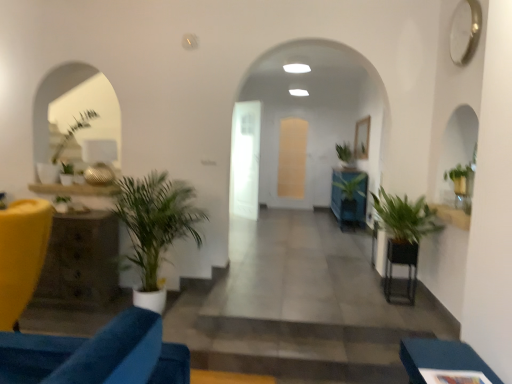
Question: From the image's perspective, is green leafy plant at right, acting as the 4th houseplant starting from the left, positioned above or below green leafy plant at left, the 4th houseplant viewed from the front?

Choices:
 (A) above
 (B) below

Answer: (B)

Question: In the image, is green leafy plant at right, acting as the 4th houseplant starting from the left, on the left side or the right side of green leafy plant at left, positioned as the 2th houseplant in left-to-right order?

Choices:
 (A) left
 (B) right

Answer: (B)

Question: Estimate the real-world distances between objects in this image. Which object is closer to the transparent glass door at center, which is the 1th glass door in front-to-back order?

Choices:
 (A) black metal table at lower right, which ranks as the 2th table in back-to-front order
 (B) rustic wood side table at left, which appears as the first table when viewed from the left
 (C) blue fabric ottoman at lower right, positioned as the first furniture in front-to-back order
 (D) green glossy plant at center, which is counted as the 2th houseplant, starting from the right
 (E) green leafy plant at left, which is counted as the 5th houseplant, starting from the right

Answer: (D)

Question: Which object is positioned closest to the translucent glass door at center, the first glass door viewed from the right?

Choices:
 (A) green glossy plant at center, which is counted as the 2th houseplant, starting from the right
 (B) matte yellow chair at left, the 2th furniture viewed from the right
 (C) green leafy plant at right, marked as the third houseplant in a right-to-left arrangement
 (D) rustic wood side table at left, which is the second table in front-to-back order
 (E) green leafy plant at left, which is counted as the 5th houseplant, starting from the right

Answer: (A)